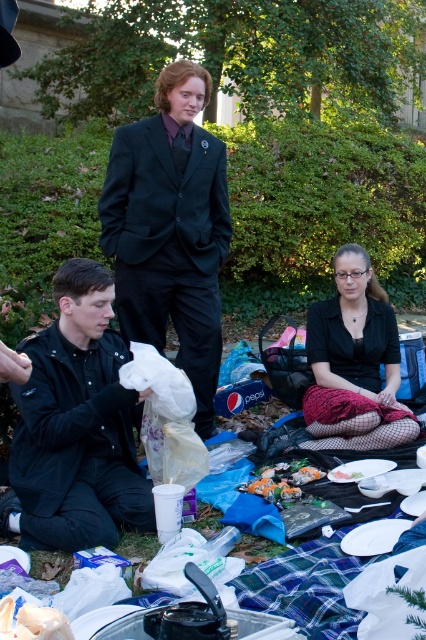
You are organizing a picnic cleanup and need to collect items from the scene. You have to pick up the black matte suit at center and the shiny plastic bag at lower center. Which item should you pick up first if you want to start with the one that is higher up?

The black matte suit at center is above the shiny plastic bag at lower center, so you should pick up the black matte suit at center first.

You are standing at the picnic area and want to move from the point at coordinates point (184, 292) to the point at coordinates point (296, 486). Which direction should you move in to get there?

To move from point (184, 292) to point (296, 486), you should move forward since point (184, 292) is behind point (296, 486).

You are standing at the camera position and want to pick up the black matte jacket at lower left. Is it within your immediate reach without moving your feet?

The black matte jacket at lower left is 2.96 meters away from the camera, so it is out of immediate reach without moving your feet.